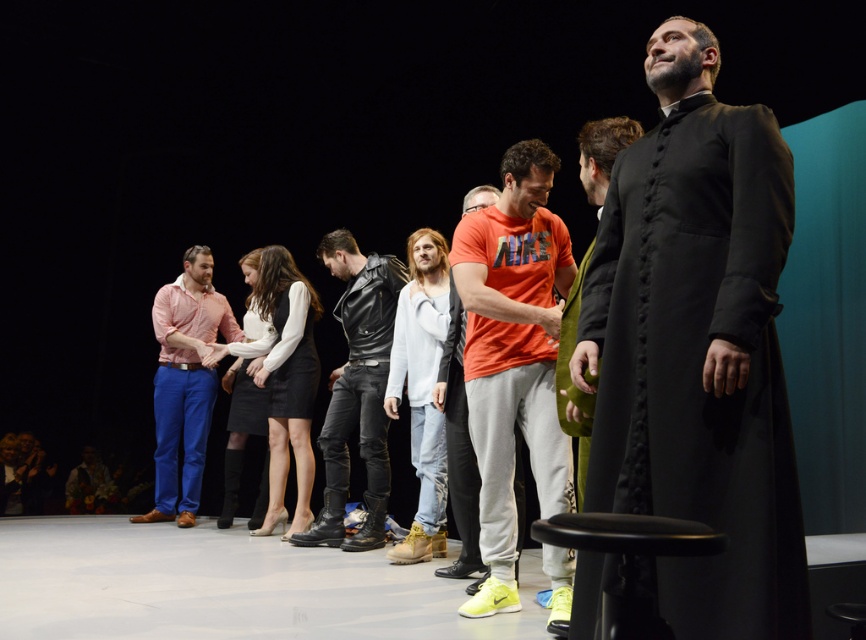
You are designing a seating arrangement for a small conference and need to seat two speakers wearing the matte pink shirt at center and the white cotton shirt at center. Since the chairs provided are standard size, which speaker might need a slightly wider chair to accommodate their shirt?

The matte pink shirt at center has a larger width than the white cotton shirt at center, so the speaker wearing the matte pink shirt at center would need a slightly wider chair.